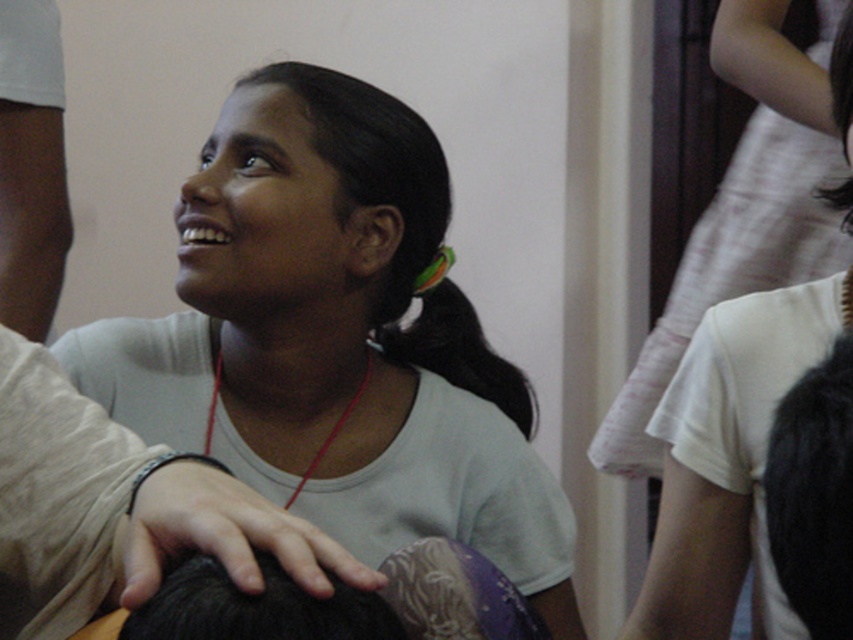
Is the position of black fuzzy hair at upper right more distant than that of black hair at center?

No, black fuzzy hair at upper right is closer to the viewer.

In the scene shown: Is black fuzzy hair at upper right thinner than black hair at center?

Yes.

Locate an element on the screen. black fuzzy hair at upper right is located at coordinates (813, 493).

Can you confirm if matte skin arm at left is positioned below dark brown hair at center?

Incorrect, matte skin arm at left is not positioned below dark brown hair at center.

Between point (44, 156) and point (381, 618), which one is positioned in front?

Point (381, 618)

This screenshot has width=853, height=640. I want to click on matte skin arm at left, so click(x=32, y=166).

Which is more to the right, matte white head at center or black silky hair at upper right?

black silky hair at upper right is more to the right.

Which is more to the left, matte white head at center or black silky hair at upper right?

matte white head at center

Is point (270, 180) closer to camera compared to point (833, 83)?

That is False.

Locate an element on the screen. This screenshot has width=853, height=640. matte white head at center is located at coordinates (355, 204).